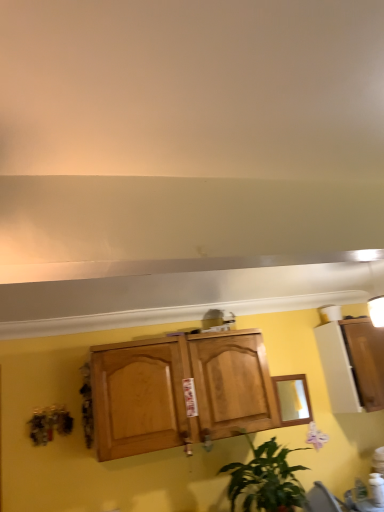
Describe the element at coordinates (265, 479) in the screenshot. I see `green leafy plant at lower center` at that location.

This screenshot has height=512, width=384. I want to click on white glossy cabinet at right, so click(x=352, y=364).

Considering the relative positions of wooden mirror at center and matte brown chair at lower right in the image provided, is wooden mirror at center to the left of matte brown chair at lower right from the viewer's perspective?

Correct, you'll find wooden mirror at center to the left of matte brown chair at lower right.

Is wooden mirror at center far from matte brown chair at lower right?

No, wooden mirror at center is not far away from matte brown chair at lower right.

From a real-world perspective, is wooden mirror at center located higher than matte brown chair at lower right?

Yes, from a real-world perspective, wooden mirror at center is on top of matte brown chair at lower right.

Which is behind, point (288, 380) or point (306, 500)?

The point (288, 380) is more distant.

Is wooden mirror at center at the back of matte brown chair at lower right?

No, matte brown chair at lower right is not facing the opposite direction of wooden mirror at center.

From a real-world perspective, between matte brown chair at lower right and wooden mirror at center, who is vertically higher?

wooden mirror at center.

Identify the location of chair in front of the wooden mirror at center. The width and height of the screenshot is (384, 512). (320, 500).

Can you confirm if wooden mirror at center is wider than white glossy cabinet at right?

No, wooden mirror at center is not wider than white glossy cabinet at right.

From a real-world perspective, does wooden mirror at center sit lower than white glossy cabinet at right?

Yes, from a real-world perspective, wooden mirror at center is below white glossy cabinet at right.

Which point is more distant from viewer, (304,402) or (343,376)?

The point (304,402) is farther from the camera.

Could white glossy cabinet at right be considered to be inside wooden mirror at center?

No, wooden mirror at center does not contain white glossy cabinet at right.

Who is bigger, matte brown chair at lower right or white glossy cabinet at right?

With larger size is white glossy cabinet at right.

Can you confirm if matte brown chair at lower right is wider than white glossy cabinet at right?

No, matte brown chair at lower right is not wider than white glossy cabinet at right.

Looking at this image, can you confirm if matte brown chair at lower right is shorter than white glossy cabinet at right?

Indeed, matte brown chair at lower right has a lesser height compared to white glossy cabinet at right.

From a real-world perspective, which is physically below, matte brown chair at lower right or white glossy cabinet at right?

matte brown chair at lower right, from a real-world perspective.

Are green leafy plant at lower center and matte brown chair at lower right beside each other?

No, green leafy plant at lower center is not beside matte brown chair at lower right.

Based on their positions, is green leafy plant at lower center located to the left or right of matte brown chair at lower right?

Based on their positions, green leafy plant at lower center is located to the left of matte brown chair at lower right.

Is green leafy plant at lower center inside or outside of matte brown chair at lower right?

green leafy plant at lower center is spatially situated outside matte brown chair at lower right.

Is green leafy plant at lower center positioned with its back to matte brown chair at lower right?

No.

Does green leafy plant at lower center have a smaller size compared to wooden mirror at center?

Actually, green leafy plant at lower center might be larger than wooden mirror at center.

Which point is more distant from viewer, (273, 455) or (293, 398)?

Positioned behind is point (293, 398).

Are green leafy plant at lower center and wooden mirror at center located far from each other?

No, green leafy plant at lower center is in close proximity to wooden mirror at center.

Is matte purple flower at lower right not within matte brown chair at lower right?

Yes, matte purple flower at lower right is outside of matte brown chair at lower right.

Is matte purple flower at lower right shorter than matte brown chair at lower right?

Yes.

Is matte purple flower at lower right touching matte brown chair at lower right?

No.

Based on their sizes in the image, would you say matte purple flower at lower right is bigger or smaller than matte brown chair at lower right?

Considering their sizes, matte purple flower at lower right takes up less space than matte brown chair at lower right.

Identify the location of chair that is under the wooden mirror at center (from a real-world perspective). This screenshot has height=512, width=384. (320, 500).

The width and height of the screenshot is (384, 512). What are the coordinates of `mirror behind the matte brown chair at lower right` in the screenshot? It's located at (292, 400).

From the image, which object appears to be farther from wooden mirror at center, matte brown chair at lower right or white glossy cabinet at right?

The object further to wooden mirror at center is matte brown chair at lower right.

Considering their positions, is green leafy plant at lower center positioned further to matte purple flower at lower right than matte brown chair at lower right?

green leafy plant at lower center is further to matte purple flower at lower right.

Consider the image. Estimate the real-world distances between objects in this image. Which object is closer to wooden mirror at center, white glossy cabinet at right or green leafy plant at lower center?

white glossy cabinet at right is positioned closer to the anchor wooden mirror at center.

Estimate the real-world distances between objects in this image. Which object is closer to matte purple flower at lower right, matte brown chair at lower right or wooden mirror at center?

Among the two, matte brown chair at lower right is located nearer to matte purple flower at lower right.

Based on their spatial positions, is green leafy plant at lower center or matte brown chair at lower right closer to wooden mirror at center?

green leafy plant at lower center lies closer to wooden mirror at center than the other object.

Which object lies further to the anchor point matte brown chair at lower right, wooden mirror at center or matte purple flower at lower right?

wooden mirror at center.

Looking at the image, which one is located further to matte purple flower at lower right, white glossy cabinet at right or matte brown chair at lower right?

Among the two, white glossy cabinet at right is located further to matte purple flower at lower right.

Looking at the image, which one is located further to matte brown chair at lower right, matte purple flower at lower right or white glossy cabinet at right?

Based on the image, white glossy cabinet at right appears to be further to matte brown chair at lower right.

Locate an element on the screen. flower between white glossy cabinet at right and matte brown chair at lower right in the up-down direction is located at coordinates (316, 436).

Where is `flower between wooden mirror at center and white glossy cabinet at right in the horizontal direction`? Image resolution: width=384 pixels, height=512 pixels. flower between wooden mirror at center and white glossy cabinet at right in the horizontal direction is located at coordinates (316, 436).

Where is `cabinetry positioned between green leafy plant at lower center and matte purple flower at lower right from near to far`? cabinetry positioned between green leafy plant at lower center and matte purple flower at lower right from near to far is located at coordinates (352, 364).

I want to click on chair between green leafy plant at lower center and matte purple flower at lower right along the z-axis, so click(320, 500).